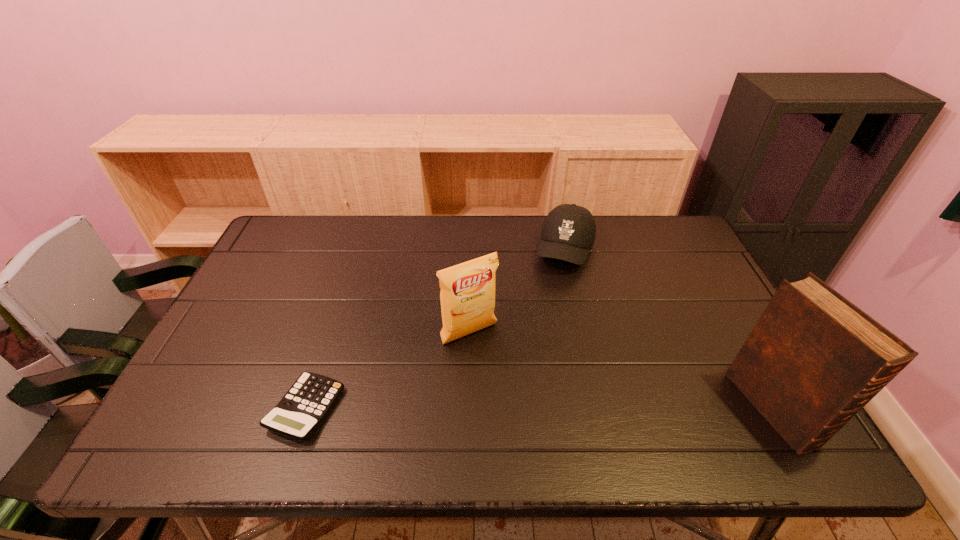
In order to click on vacant space on the desktop that is between the calculator and the tallest object and is positioned on the front of the third nearest object with the logo in this screenshot , I will do `click(519, 408)`.

At what (x,y) coordinates should I click in order to perform the action: click on free spot on the desktop that is between the calculator and the Bible and is positioned on the front-facing side of the farthest object. Please return your answer as a coordinate pair (x, y). The height and width of the screenshot is (540, 960). Looking at the image, I should click on (514, 408).